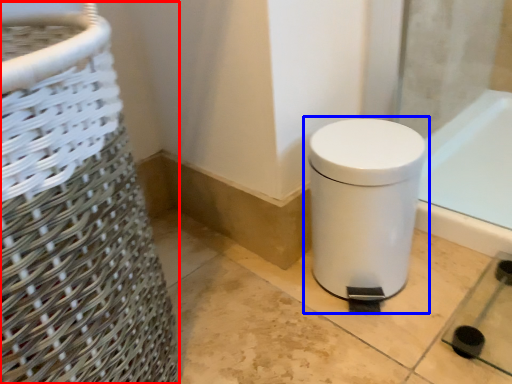
Question: Which point is further to the camera, basket container (highlighted by a red box) or waste container (highlighted by a blue box)?

Choices:
 (A) basket container
 (B) waste container

Answer: (B)